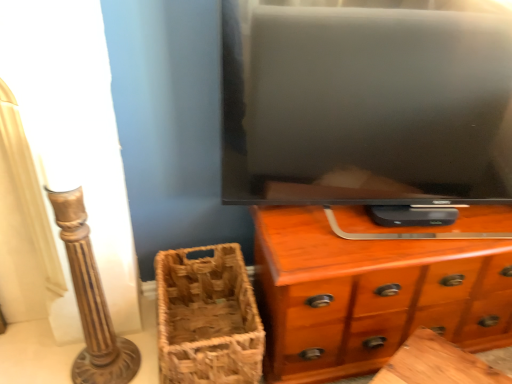
Where is `wooden chest of drawers at center`? This screenshot has width=512, height=384. wooden chest of drawers at center is located at coordinates (370, 294).

The width and height of the screenshot is (512, 384). Describe the element at coordinates (370, 294) in the screenshot. I see `wooden chest of drawers at center` at that location.

Locate an element on the screen. brown woven basket at lower left is located at coordinates (207, 318).

The width and height of the screenshot is (512, 384). Describe the element at coordinates (207, 318) in the screenshot. I see `brown woven basket at lower left` at that location.

Find the location of a particular element. wooden chest of drawers at center is located at coordinates (370, 294).

Which is more to the left, wooden chest of drawers at center or brown woven basket at lower left?

From the viewer's perspective, brown woven basket at lower left appears more on the left side.

Consider the image. In the image, is wooden chest of drawers at center positioned in front of or behind brown woven basket at lower left?

In the image, wooden chest of drawers at center appears in front of brown woven basket at lower left.

Considering the positions of point (484, 239) and point (177, 346), is point (484, 239) closer or farther from the camera than point (177, 346)?

Point (484, 239) appears to be farther away from the viewer than point (177, 346).

From the image's perspective, is wooden chest of drawers at center over brown woven basket at lower left?

Yes.

From a real-world perspective, is wooden chest of drawers at center over brown woven basket at lower left?

Yes, from a real-world perspective, wooden chest of drawers at center is above brown woven basket at lower left.

Which object is wider, wooden chest of drawers at center or brown woven basket at lower left?

With larger width is brown woven basket at lower left.

Can you confirm if wooden chest of drawers at center is shorter than brown woven basket at lower left?

Incorrect, the height of wooden chest of drawers at center does not fall short of that of brown woven basket at lower left.

Which of these two, wooden chest of drawers at center or brown woven basket at lower left, is bigger?

Bigger between the two is wooden chest of drawers at center.

Is brown woven basket at lower left located within wooden chest of drawers at center?

No, brown woven basket at lower left is not a part of wooden chest of drawers at center.

Are wooden chest of drawers at center and brown woven basket at lower left far apart?

No.

Consider the image. Is wooden chest of drawers at center facing away from brown woven basket at lower left?

That's not correct — wooden chest of drawers at center is not looking away from brown woven basket at lower left.

How many degrees apart are the facing directions of wooden chest of drawers at center and brown woven basket at lower left?

The facing directions of wooden chest of drawers at center and brown woven basket at lower left are 0.000443 degrees apart.

The image size is (512, 384). I want to click on basket that is behind the wooden chest of drawers at center, so click(x=207, y=318).

Does brown woven basket at lower left appear on the left side of wooden chest of drawers at center?

Yes, brown woven basket at lower left is to the left of wooden chest of drawers at center.

Is the position of brown woven basket at lower left more distant than that of wooden chest of drawers at center?

Yes, brown woven basket at lower left is behind wooden chest of drawers at center.

Does point (233, 326) come farther from viewer compared to point (490, 231)?

Yes, it is behind point (490, 231).

From the image's perspective, which object appears higher, brown woven basket at lower left or wooden chest of drawers at center?

wooden chest of drawers at center appears higher in the image.

From a real-world perspective, is brown woven basket at lower left above or below wooden chest of drawers at center?

Clearly, from a real-world perspective, brown woven basket at lower left is below wooden chest of drawers at center.

Which object is wider, brown woven basket at lower left or wooden chest of drawers at center?

brown woven basket at lower left is wider.

Considering the sizes of objects brown woven basket at lower left and wooden chest of drawers at center in the image provided, who is taller, brown woven basket at lower left or wooden chest of drawers at center?

With more height is wooden chest of drawers at center.

From the picture: Considering the sizes of objects brown woven basket at lower left and wooden chest of drawers at center in the image provided, who is bigger, brown woven basket at lower left or wooden chest of drawers at center?

Bigger between the two is wooden chest of drawers at center.

Would you say brown woven basket at lower left is outside wooden chest of drawers at center?

That's correct, brown woven basket at lower left is outside of wooden chest of drawers at center.

Is brown woven basket at lower left touching wooden chest of drawers at center?

brown woven basket at lower left is not next to wooden chest of drawers at center, and they're not touching.

Is wooden chest of drawers at center at the back of brown woven basket at lower left?

No, brown woven basket at lower left is not facing the opposite direction of wooden chest of drawers at center.

Measure the distance between brown woven basket at lower left and wooden chest of drawers at center.

brown woven basket at lower left is 30.14 centimeters away from wooden chest of drawers at center.

Locate an element on the screen. This screenshot has width=512, height=384. chest of drawers above the brown woven basket at lower left (from the image's perspective) is located at coordinates (370, 294).

Where is `chest of drawers above the brown woven basket at lower left (from a real-world perspective)`? This screenshot has width=512, height=384. chest of drawers above the brown woven basket at lower left (from a real-world perspective) is located at coordinates (370, 294).

What are the coordinates of `basket located underneath the wooden chest of drawers at center (from a real-world perspective)` in the screenshot? It's located at (207, 318).